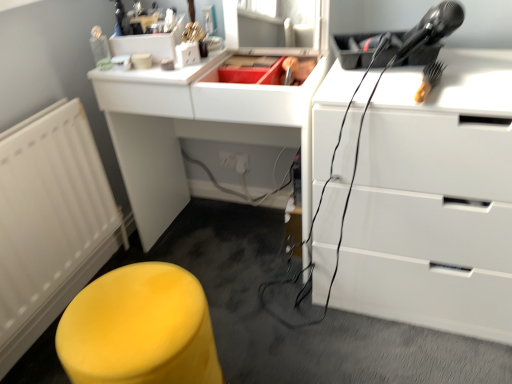
The width and height of the screenshot is (512, 384). I want to click on unoccupied space behind yellow plastic brush at upper right, so click(x=407, y=72).